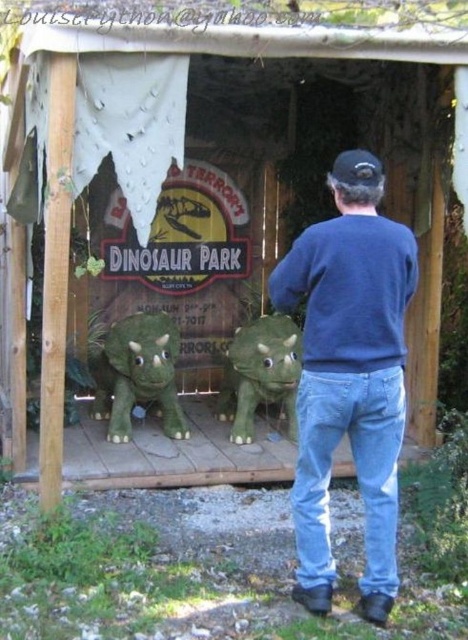
Question: Which point is farther to the camera?

Choices:
 (A) green plush dinosaur at center
 (B) blue cotton sweater at center
 (C) green matte dinosaur at center

Answer: (A)

Question: Does blue cotton sweater at center have a larger size compared to green plush dinosaur at center?

Choices:
 (A) yes
 (B) no

Answer: (A)

Question: Which point is farther to the camera?

Choices:
 (A) (349, 353)
 (B) (292, 419)

Answer: (B)

Question: Considering the relative positions of blue cotton sweater at center and green matte dinosaur at center in the image provided, where is blue cotton sweater at center located with respect to green matte dinosaur at center?

Choices:
 (A) above
 (B) below

Answer: (A)

Question: Considering the relative positions of blue cotton sweater at center and green plush dinosaur at center in the image provided, where is blue cotton sweater at center located with respect to green plush dinosaur at center?

Choices:
 (A) left
 (B) right

Answer: (B)

Question: Which of the following is the closest to the observer?

Choices:
 (A) (162, 358)
 (B) (396, 300)

Answer: (B)